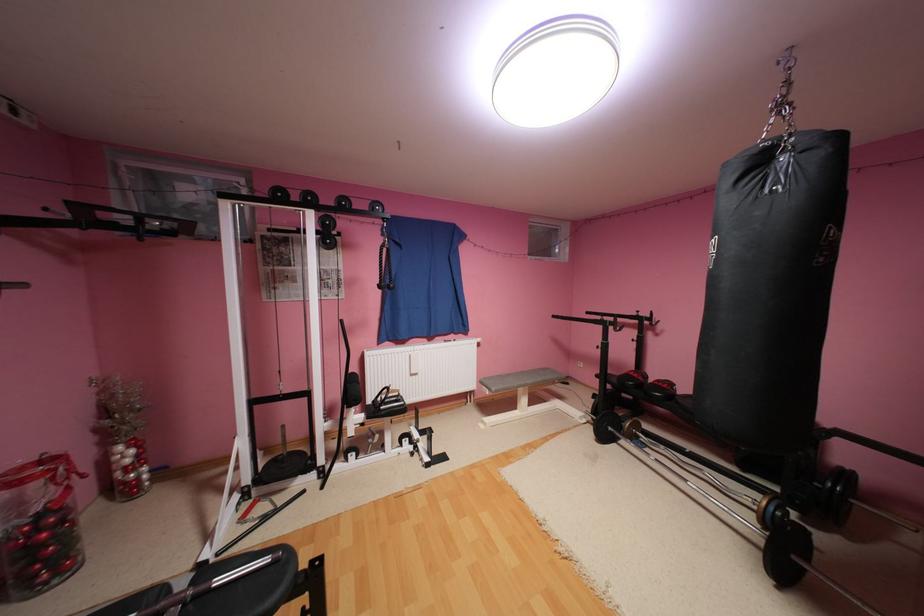
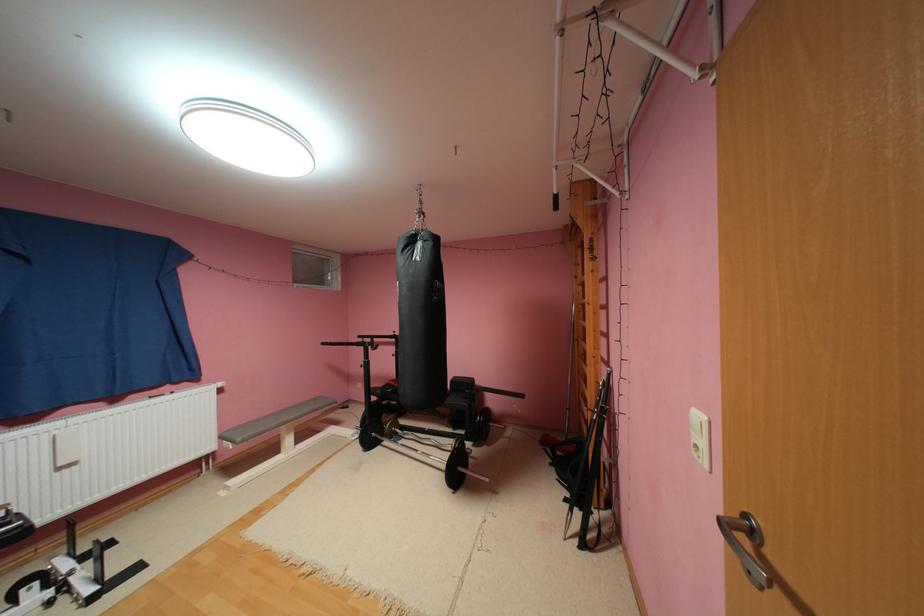
Find the pixel in the second image that matches [763,508] in the first image.

(458, 450)